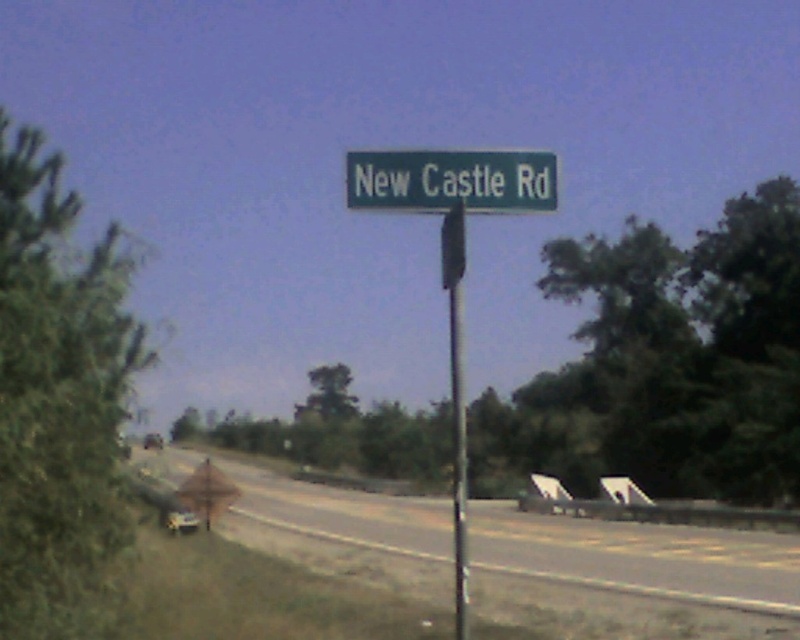
Question: Can you confirm if gray asphalt highway at center is positioned to the left of metallic silver car at center?

Choices:
 (A) no
 (B) yes

Answer: (A)

Question: Which is nearer to the metallic pole at center?

Choices:
 (A) metallic silver car at lower left
 (B) gray asphalt highway at center

Answer: (B)

Question: Which point appears closest to the camera in this image?

Choices:
 (A) (458, 426)
 (B) (180, 531)
 (C) (750, 566)

Answer: (A)

Question: Is gray asphalt highway at center to the left of metallic silver car at center from the viewer's perspective?

Choices:
 (A) yes
 (B) no

Answer: (B)

Question: Does green metallic street sign at center come in front of metallic silver car at lower left?

Choices:
 (A) yes
 (B) no

Answer: (A)

Question: Estimate the real-world distances between objects in this image. Which object is farther from the metallic pole at center?

Choices:
 (A) gray asphalt highway at center
 (B) metallic silver car at center

Answer: (B)